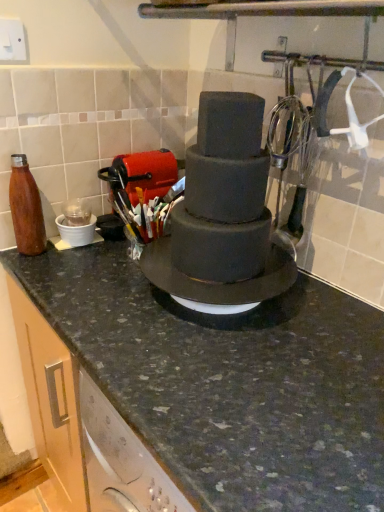
This screenshot has height=512, width=384. Find the location of `vacant area that lies to the right of matte brown bottle at left`. vacant area that lies to the right of matte brown bottle at left is located at coordinates (81, 263).